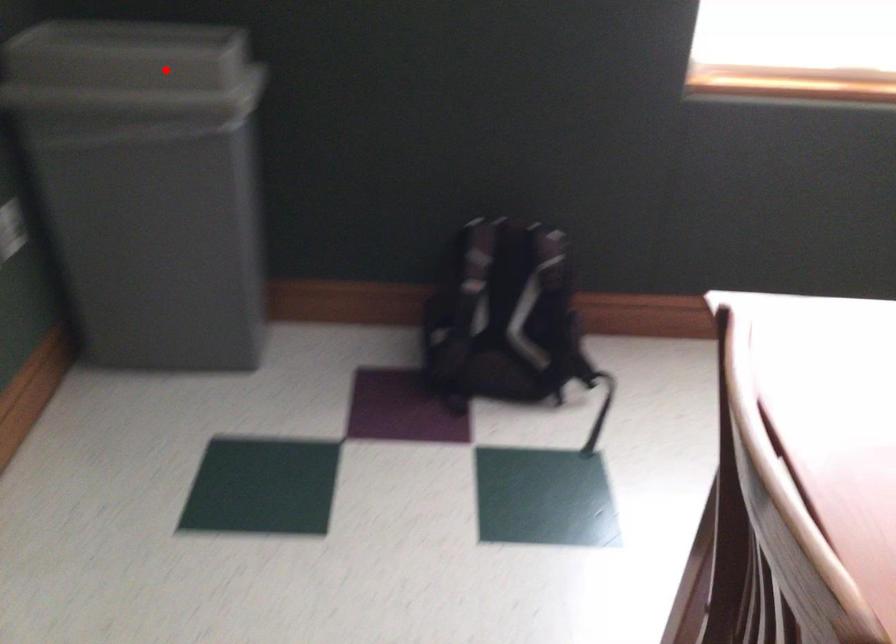
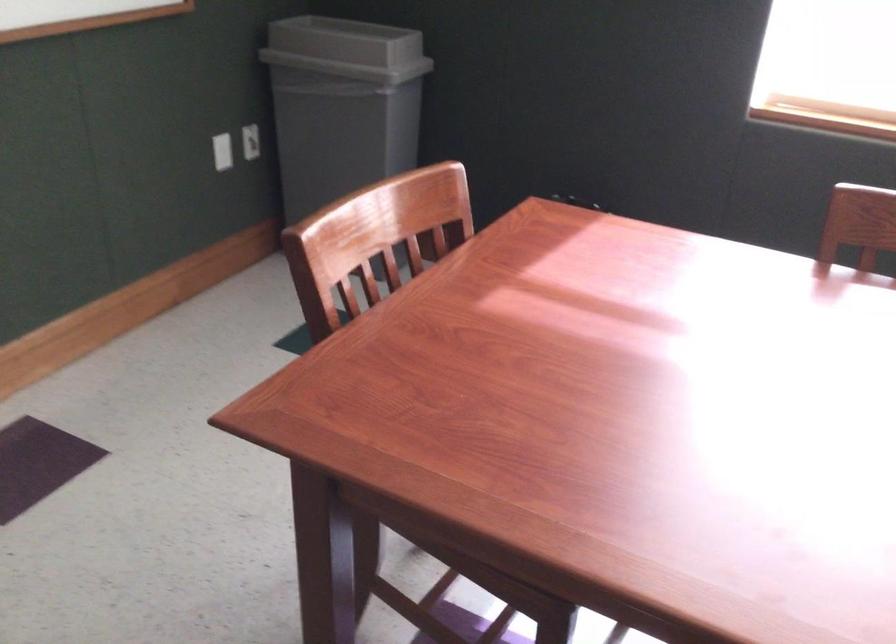
The point at the highlighted location is marked in the first image. Where is the corresponding point in the second image?

(346, 49)